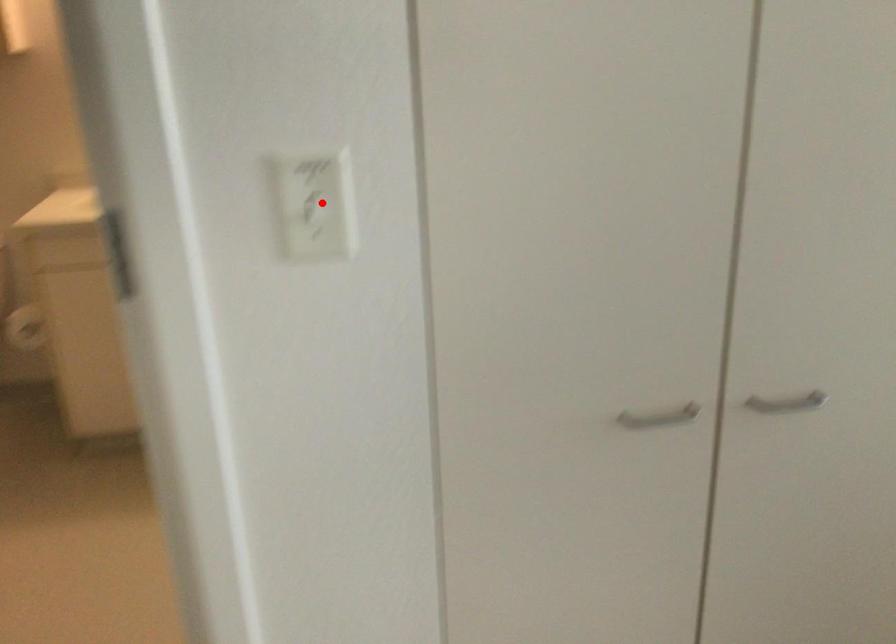
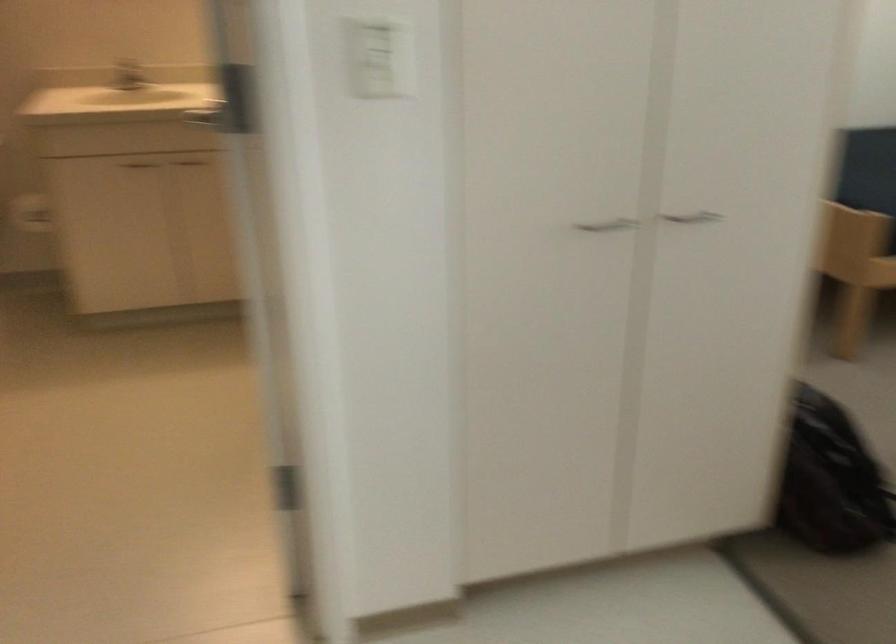
Question: I am providing you with two images of the same scene from different viewpoints. In image1, a red point is highlighted. Considering the same 3D point in image2, which of the following is correct?

Choices:
 (A) It is closer
 (B) It is farther

Answer: (B)